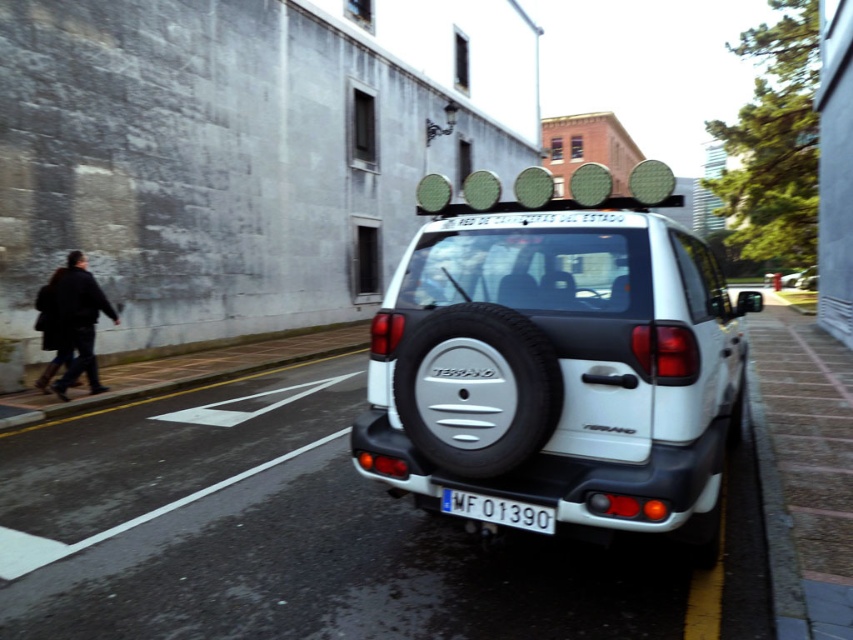
You are a delivery person who needs to load a large package into the trunk of the white matte minivan at center. The package is too big to fit through the passenger door. Which object in the scene could potentially block access to the trunk if placed near the dark wool coat at left?

The white matte minivan at center is larger than the dark wool coat at left, so if the dark wool coat at left is placed near the trunk area, it might not block access since the minivan is bigger. However, the description only mentions size comparison, not exact positioning, so it is unclear if the coat would obstruct the trunk.

You are a delivery person who needs to deliver a package to the white matte minivan at center and the dark wool coat at left. Which one is closer to the sidewalk? Please answer based on their positions in the image.

The dark wool coat at left is closer to the sidewalk because the white matte minivan at center is to the right of it, meaning the dark wool coat at left is positioned nearer to the sidewalk area.

You are a delivery person trying to read the license plate of the white SUV parked on the right. However, a person in a dark wool coat at left is blocking your view. Can you still see the white plastic license plate at center?

The white plastic license plate at center is behind the dark wool coat at left, so it is blocked from view. You cannot see the license plate.